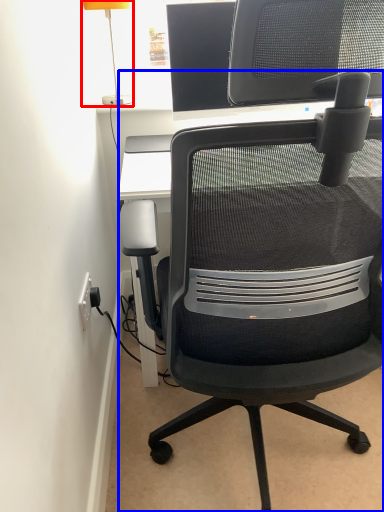
Question: Which point is closer to the camera, table lamp (highlighted by a red box) or chair (highlighted by a blue box)?

Choices:
 (A) table lamp
 (B) chair

Answer: (B)